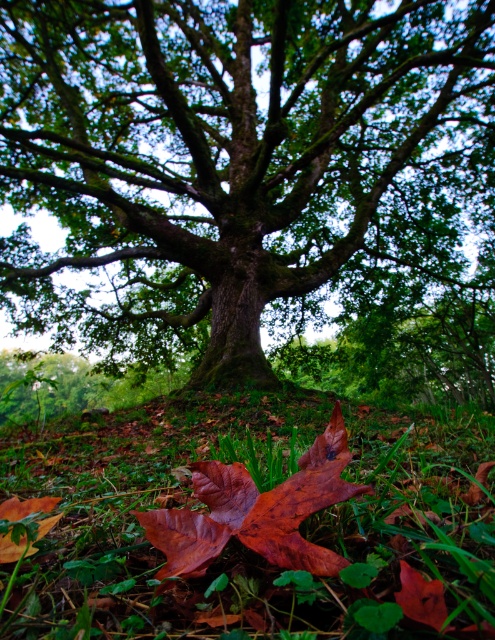
Can you confirm if green matte grass at lower center is smaller than shiny brown maple leaf at center?

No.

Can you confirm if green matte grass at lower center is shorter than shiny brown maple leaf at center?

No.

The image size is (495, 640). Describe the element at coordinates (250, 522) in the screenshot. I see `green matte grass at lower center` at that location.

This screenshot has width=495, height=640. What are the coordinates of `green matte grass at lower center` in the screenshot? It's located at 250,522.

Is green matte grass at lower center shorter than shiny brown leaf at center?

No.

Consider the image. Does green matte grass at lower center have a greater width compared to shiny brown leaf at center?

Correct, the width of green matte grass at lower center exceeds that of shiny brown leaf at center.

This screenshot has height=640, width=495. Describe the element at coordinates (250, 522) in the screenshot. I see `green matte grass at lower center` at that location.

The image size is (495, 640). In order to click on green matte grass at lower center in this screenshot , I will do `click(250, 522)`.

Can you confirm if green rough bark tree at center is positioned to the right of shiny brown maple leaf at center?

Yes, green rough bark tree at center is to the right of shiny brown maple leaf at center.

Which is more to the left, green rough bark tree at center or shiny brown maple leaf at center?

From the viewer's perspective, shiny brown maple leaf at center appears more on the left side.

Between point (296, 275) and point (440, 593), which one is positioned in front?

Positioned in front is point (440, 593).

The width and height of the screenshot is (495, 640). Identify the location of green rough bark tree at center. (234, 160).